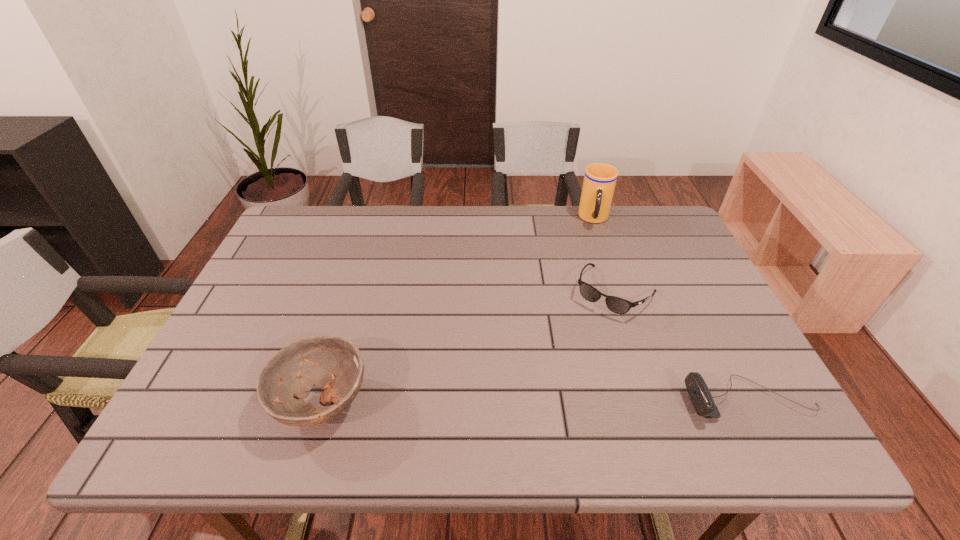
At what (x,y) coordinates should I click in order to perform the action: click on free spot between the leftmost object and the sunglasses. Please return your answer as a coordinate pair (x, y). This screenshot has height=540, width=960. Looking at the image, I should click on (468, 347).

Locate an element on the screen. free spot between the webcam and the farthest object is located at coordinates (672, 309).

Locate an element on the screen. The width and height of the screenshot is (960, 540). free space between the bowl and the sunglasses is located at coordinates (468, 347).

Where is `vacant space in between the leftmost object and the sunglasses`? The image size is (960, 540). vacant space in between the leftmost object and the sunglasses is located at coordinates (468, 347).

Image resolution: width=960 pixels, height=540 pixels. I want to click on free space between the bowl and the second farthest object, so click(x=468, y=347).

Identify the location of free space between the webcam and the bowl. pyautogui.click(x=536, y=401).

Where is `empty space that is in between the farthest object and the sunglasses`? This screenshot has height=540, width=960. empty space that is in between the farthest object and the sunglasses is located at coordinates (605, 255).

You are a GUI agent. You are given a task and a screenshot of the screen. Output one action in this format:
    pyautogui.click(x=<x>, y=<y>)
    Task: Click on the object that is the third closest to the bowl
    This screenshot has width=960, height=540.
    Given the screenshot: What is the action you would take?
    pyautogui.click(x=600, y=179)

Locate which object ranks third in proximity to the sunglasses. Please provide its 2D coordinates. Your answer should be formatted as a tuple, i.e. [(x, y)], where the tuple contains the x and y coordinates of a point satisfying the conditions above.

[(332, 362)]

This screenshot has height=540, width=960. Find the location of `vacant space that satisfies the following two spatial constraints: 1. on the back side of the webcam; 2. on the front-facing side of the bowl`. vacant space that satisfies the following two spatial constraints: 1. on the back side of the webcam; 2. on the front-facing side of the bowl is located at coordinates (323, 400).